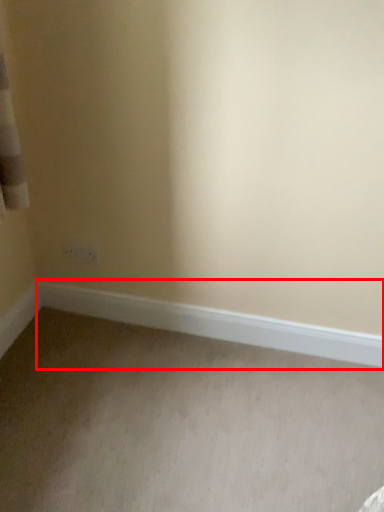
Question: From the image's perspective, considering the relative positions of window sill (annotated by the red box) and plain in the image provided, where is window sill (annotated by the red box) located with respect to the staircase?

Choices:
 (A) below
 (B) above

Answer: (B)